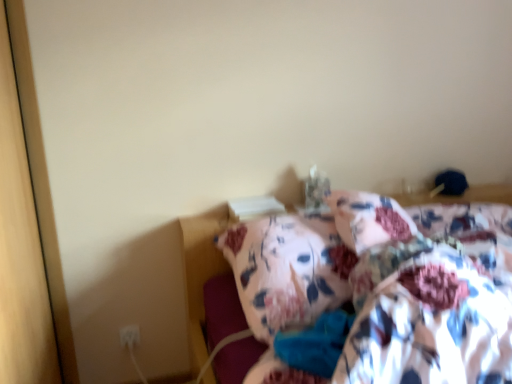
Question: Is floral fabric blanket at center directly adjacent to floral fabric bed at center?

Choices:
 (A) yes
 (B) no

Answer: (B)

Question: From a real-world perspective, is floral fabric blanket at center on floral fabric bed at center?

Choices:
 (A) yes
 (B) no

Answer: (A)

Question: Is floral fabric blanket at center far away from floral fabric bed at center?

Choices:
 (A) yes
 (B) no

Answer: (B)

Question: Considering the relative sizes of floral fabric blanket at center and floral fabric bed at center in the image provided, is floral fabric blanket at center thinner than floral fabric bed at center?

Choices:
 (A) yes
 (B) no

Answer: (A)

Question: From the image's perspective, is floral fabric blanket at center on floral fabric bed at center?

Choices:
 (A) no
 (B) yes

Answer: (B)

Question: Choose the correct answer: Is floral fabric blanket at center inside white plastic electric outlet at lower left or outside it?

Choices:
 (A) inside
 (B) outside

Answer: (B)

Question: In the image, is floral fabric blanket at center positioned in front of or behind white plastic electric outlet at lower left?

Choices:
 (A) behind
 (B) front

Answer: (B)

Question: From the image's perspective, relative to white plastic electric outlet at lower left, is floral fabric blanket at center above or below?

Choices:
 (A) below
 (B) above

Answer: (B)

Question: Considering the positions of floral fabric blanket at center and white plastic electric outlet at lower left in the image, is floral fabric blanket at center bigger or smaller than white plastic electric outlet at lower left?

Choices:
 (A) small
 (B) big

Answer: (B)

Question: Looking at their shapes, would you say white plastic electric outlet at lower left is wider or thinner than floral fabric bed at center?

Choices:
 (A) thin
 (B) wide

Answer: (A)

Question: From a real-world perspective, relative to floral fabric bed at center, is white plastic electric outlet at lower left vertically above or below?

Choices:
 (A) below
 (B) above

Answer: (A)

Question: From their relative heights in the image, would you say white plastic electric outlet at lower left is taller or shorter than floral fabric bed at center?

Choices:
 (A) tall
 (B) short

Answer: (B)

Question: In the image, is white plastic electric outlet at lower left positioned in front of or behind floral fabric bed at center?

Choices:
 (A) front
 (B) behind

Answer: (B)

Question: Based on their sizes in the image, would you say white plastic electric outlet at lower left is bigger or smaller than floral fabric blanket at center?

Choices:
 (A) small
 (B) big

Answer: (A)

Question: Considering their positions, is white plastic electric outlet at lower left located in front of or behind floral fabric blanket at center?

Choices:
 (A) behind
 (B) front

Answer: (A)